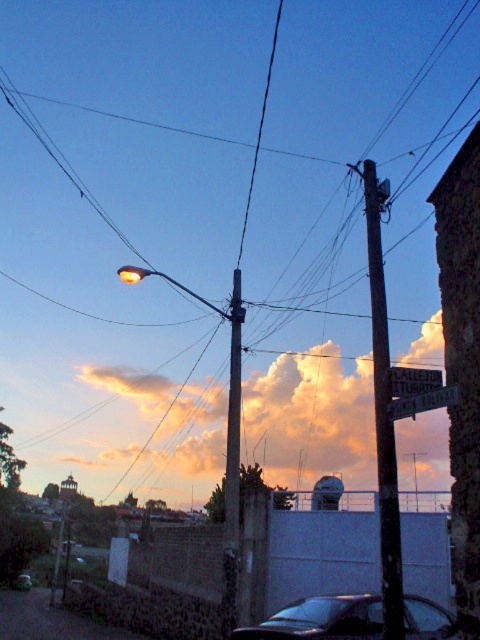
You are standing at the point marked as point (412,381) in the image. Looking around, you see a metallic silver sign at upper center. What object is located at your current position?

The metallic silver sign at upper center is located at point (412,381).